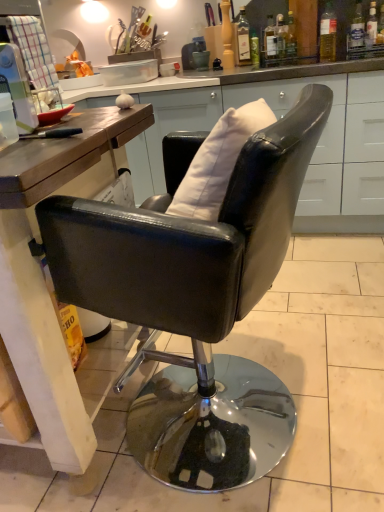
At what (x,y) coordinates should I click in order to perform the action: click on vacant space to the left of translucent glass bottle at upper right, which is the sixth bottle in left-to-right order. Please return your answer as a coordinate pair (x, y). This screenshot has width=384, height=512. Looking at the image, I should click on (307, 60).